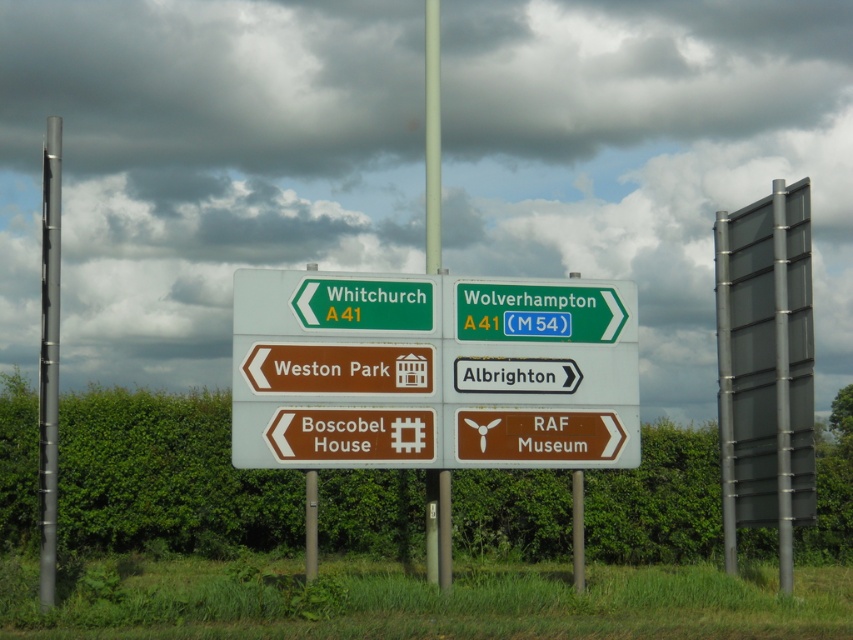
You are standing in front of the signboard and want to check if the metallic gray pole at left is positioned higher than the green matte sign at left. Can you confirm this?

The metallic gray pole at left is above the green matte sign at left, so yes, it is positioned higher.

What is located at the coordinates point (432,371)?

The green plastic road sign at center is located at point (432,371).

You are standing at the roadside looking at the directional signboard. There is a metallic gray pole at left and a green matte sign at left. Which object is closer to you?

The metallic gray pole at left is closer to you because it is in front of the green matte sign at left.